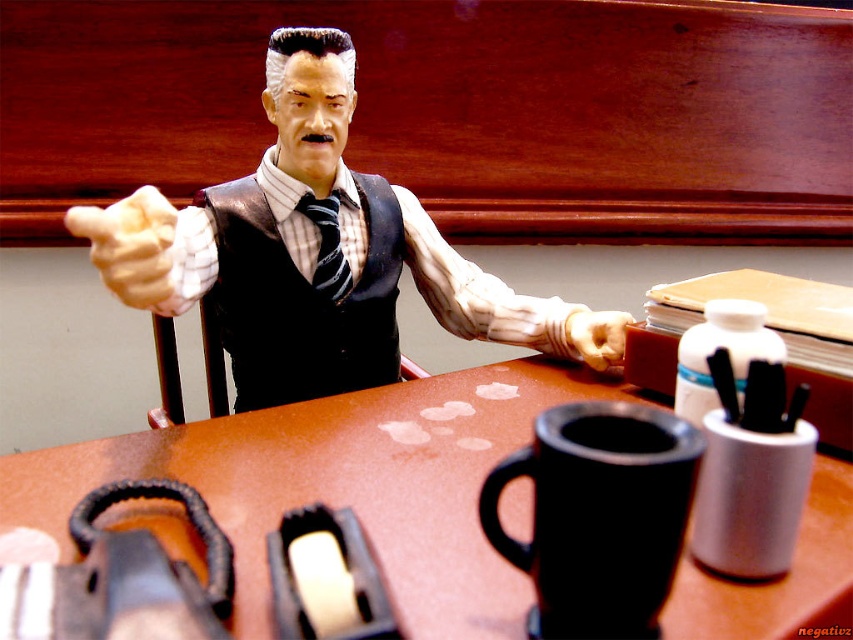
Can you confirm if brown matte table at center is positioned below black matte coffee cup at lower center?

Correct, brown matte table at center is located below black matte coffee cup at lower center.

Describe the element at coordinates (341, 484) in the screenshot. I see `brown matte table at center` at that location.

I want to click on brown matte table at center, so click(341, 484).

Does brown matte table at center appear over matte black vest at center?

No, brown matte table at center is not above matte black vest at center.

Between brown matte table at center and matte black vest at center, which one is positioned higher?

matte black vest at center

Is point (24, 520) less distant than point (265, 225)?

Yes, it is.

This screenshot has width=853, height=640. I want to click on brown matte table at center, so click(x=341, y=484).

Is matte black vest at center to the left of black matte coffee cup at lower center from the viewer's perspective?

Yes, matte black vest at center is to the left of black matte coffee cup at lower center.

Which of these two, matte black vest at center or black matte coffee cup at lower center, stands shorter?

black matte coffee cup at lower center is shorter.

The width and height of the screenshot is (853, 640). What are the coordinates of `matte black vest at center` in the screenshot? It's located at (317, 252).